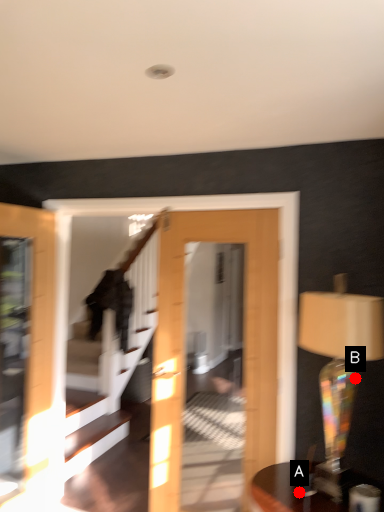
Question: Two points are circled on the image, labeled by A and B beside each circle. Among these points, which one is nearest to the camera?

Choices:
 (A) A is closer
 (B) B is closer

Answer: (A)